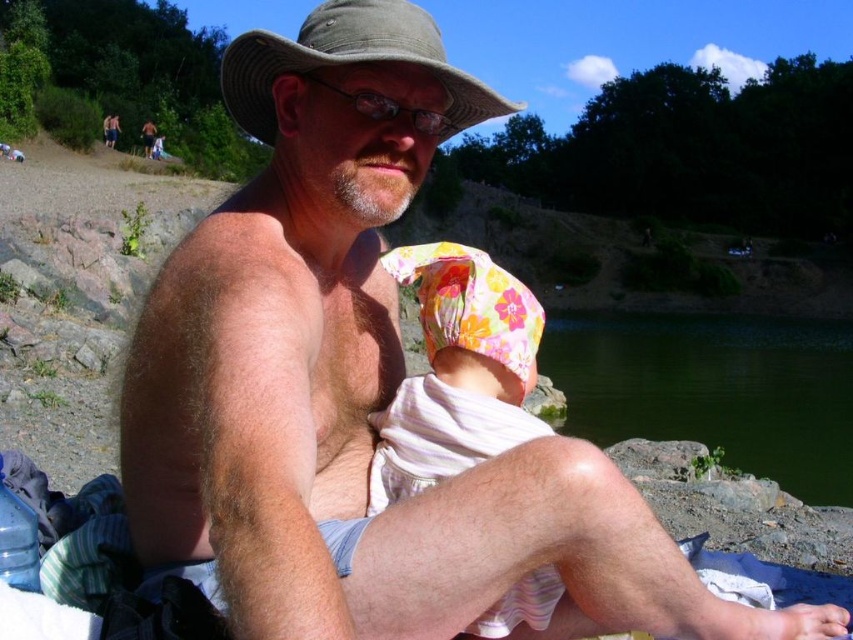
You are a photographer taking a picture of the scene. You need to ensure that both the floral fabric baby at center and the khaki fabric hat at upper center are clearly visible. Which object should you focus on first to ensure the other remains in focus?

The floral fabric baby at center is below the khaki fabric hat at upper center, so focusing on the khaki fabric hat at upper center first will help keep the baby in focus as it is closer to the camera.

You are a photographer trying to capture a photo of the green water at lower center and the khaki fabric hat at upper center. Based on their positions, which object would appear larger in the photo?

The green water at lower center appears larger in the photo because it is much taller than the khaki fabric hat at upper center.